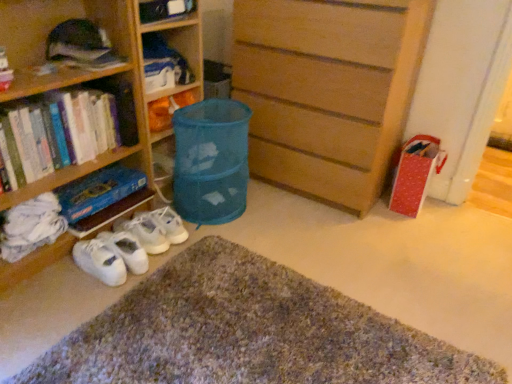
This screenshot has height=384, width=512. In order to click on vacant area that lies between textured woolen doormat at lower center and blue fabric laundry basket at center in this screenshot , I will do `click(282, 265)`.